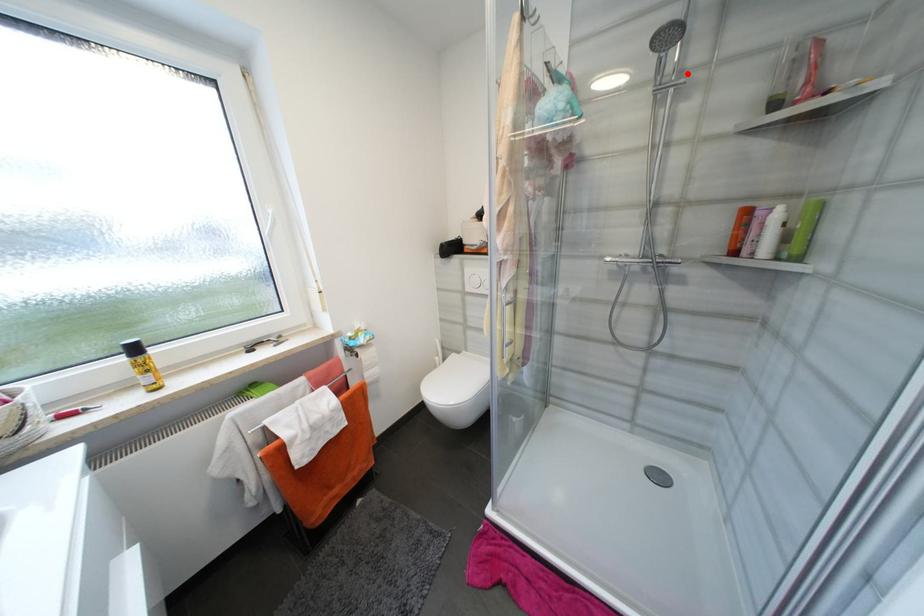
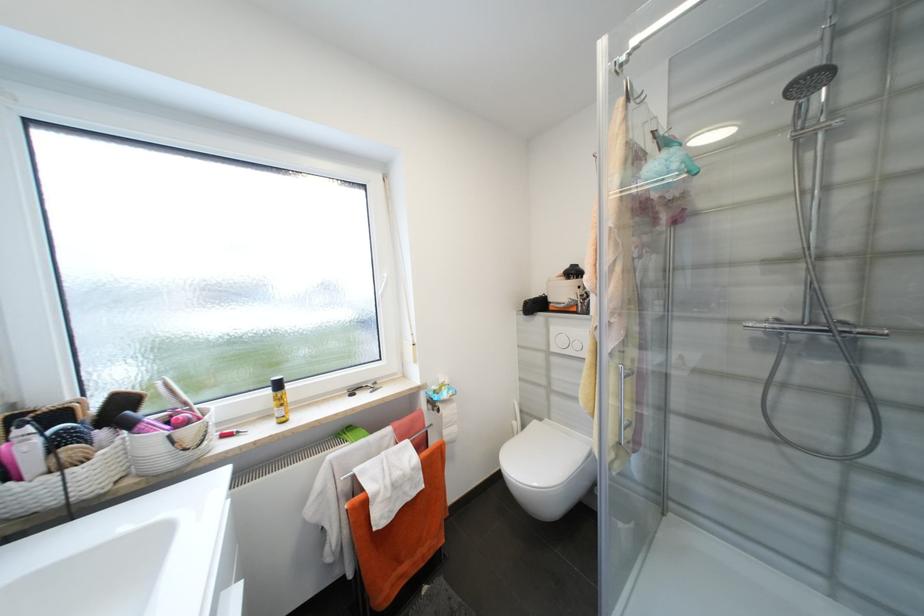
Find the pixel in the second image that matches the highlighted location in the first image.

(839, 114)